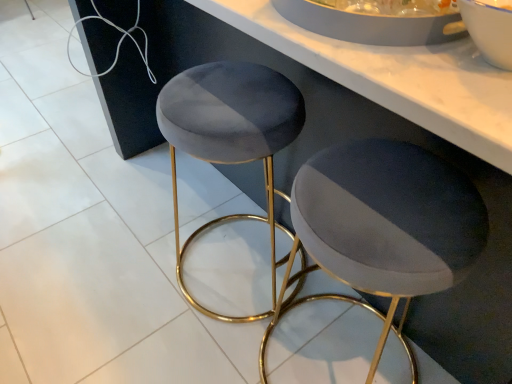
Locate an element on the screen. velvet grey stool at center is located at coordinates (383, 226).

This screenshot has height=384, width=512. Describe the element at coordinates (383, 226) in the screenshot. I see `velvet grey stool at center` at that location.

What is the approximate width of velvet grey stool at center?

velvet grey stool at center is 16.99 inches wide.

You are a GUI agent. You are given a task and a screenshot of the screen. Output one action in this format:
    pyautogui.click(x=<x>, y=<y>)
    Task: Click on the velvet grey stool at center
    The width and height of the screenshot is (512, 384).
    Given the screenshot: What is the action you would take?
    pyautogui.click(x=383, y=226)